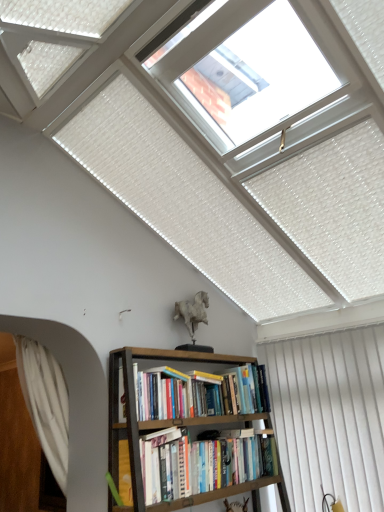
Identify the location of white vertical blinds at right, the first curtain from the right. The width and height of the screenshot is (384, 512). (329, 416).

In order to click on brown wooden bookcase at center in this screenshot , I will do `click(185, 433)`.

Image resolution: width=384 pixels, height=512 pixels. Describe the element at coordinates (165, 465) in the screenshot. I see `hardcover book at lower center` at that location.

You are a GUI agent. You are given a task and a screenshot of the screen. Output one action in this format:
    pyautogui.click(x=<x>, y=<y>)
    Task: Click on the white sheer curtain at left, marked as the 1th curtain in a left-to-right arrangement
    
    Given the screenshot: What is the action you would take?
    pyautogui.click(x=45, y=403)

At what (x,y) coordinates should I click in order to perform the action: click on hardcover books at center. Please return your answer as a coordinate pair (x, y). This screenshot has width=384, height=512. Looking at the image, I should click on (203, 465).

Is hardcover books at center far away from white sheer curtain at left, positioned as the second curtain in right-to-left order?

They are positioned close to each other.

Who is smaller, hardcover books at center or white sheer curtain at left, positioned as the second curtain in right-to-left order?

With smaller size is hardcover books at center.

From the image's perspective, does hardcover books at center appear higher than white sheer curtain at left, marked as the 1th curtain in a left-to-right arrangement?

No, from the image's perspective, hardcover books at center is not above white sheer curtain at left, marked as the 1th curtain in a left-to-right arrangement.

In the scene shown: Is hardcover books at center positioned before white sheer curtain at left, marked as the 1th curtain in a left-to-right arrangement?

No, the depth of hardcover books at center is greater than that of white sheer curtain at left, marked as the 1th curtain in a left-to-right arrangement.

Is hardcover book at lower center wider or thinner than white vertical blinds at right, placed as the second curtain when sorted from left to right?

hardcover book at lower center is wider than white vertical blinds at right, placed as the second curtain when sorted from left to right.

Which object is closer to the camera taking this photo, hardcover book at lower center or white vertical blinds at right, the first curtain from the right?

hardcover book at lower center is more forward.

Is hardcover book at lower center bigger than white vertical blinds at right, the first curtain from the right?

No, hardcover book at lower center is not bigger than white vertical blinds at right, the first curtain from the right.

Considering the sizes of objects hardcover book at lower center and white vertical blinds at right, placed as the second curtain when sorted from left to right, in the image provided, who is taller, hardcover book at lower center or white vertical blinds at right, placed as the second curtain when sorted from left to right,?

Standing taller between the two is white vertical blinds at right, placed as the second curtain when sorted from left to right.

From the picture: How different are the orientations of transparent glass skylight at upper center and white sheer curtain at left, marked as the 1th curtain in a left-to-right arrangement, in degrees?

92.6 degrees.

Would you say white sheer curtain at left, positioned as the second curtain in right-to-left order, is part of transparent glass skylight at upper center's contents?

No, white sheer curtain at left, positioned as the second curtain in right-to-left order, is not inside transparent glass skylight at upper center.

Is the position of transparent glass skylight at upper center less distant than that of white sheer curtain at left, positioned as the second curtain in right-to-left order?

Yes, transparent glass skylight at upper center is closer to the viewer.

Is transparent glass skylight at upper center at the right side of white sheer curtain at left, marked as the 1th curtain in a left-to-right arrangement?

Indeed, transparent glass skylight at upper center is positioned on the right side of white sheer curtain at left, marked as the 1th curtain in a left-to-right arrangement.

From a real-world perspective, is white vertical blinds at right, the first curtain from the right, positioned above or below brown wooden bookcase at center?

In terms of real-world spatial position, white vertical blinds at right, the first curtain from the right, is above brown wooden bookcase at center.

Can you tell me how much white vertical blinds at right, placed as the second curtain when sorted from left to right, and brown wooden bookcase at center differ in facing direction?

There is a 89.7-degree angle between the facing directions of white vertical blinds at right, placed as the second curtain when sorted from left to right, and brown wooden bookcase at center.

Can brown wooden bookcase at center be found inside white vertical blinds at right, placed as the second curtain when sorted from left to right?

That's incorrect, brown wooden bookcase at center is not inside white vertical blinds at right, placed as the second curtain when sorted from left to right.

Which is in front, white vertical blinds at right, the first curtain from the right, or brown wooden bookcase at center?

brown wooden bookcase at center is in front.

Considering the sizes of white sheer curtain at left, positioned as the second curtain in right-to-left order, and brown wooden bookcase at center in the image, is white sheer curtain at left, positioned as the second curtain in right-to-left order, taller or shorter than brown wooden bookcase at center?

Considering their sizes, white sheer curtain at left, positioned as the second curtain in right-to-left order, has more height than brown wooden bookcase at center.

How different are the orientations of white sheer curtain at left, positioned as the second curtain in right-to-left order, and brown wooden bookcase at center in degrees?

177 degrees separate the facing orientations of white sheer curtain at left, positioned as the second curtain in right-to-left order, and brown wooden bookcase at center.

Does white sheer curtain at left, marked as the 1th curtain in a left-to-right arrangement, have a lesser width compared to brown wooden bookcase at center?

Yes, white sheer curtain at left, marked as the 1th curtain in a left-to-right arrangement, is thinner than brown wooden bookcase at center.

Could you tell me if white sheer curtain at left, positioned as the second curtain in right-to-left order, is turned towards brown wooden bookcase at center?

No.

How different are the orientations of hardcover books at center and transparent glass skylight at upper center in degrees?

The angular difference between hardcover books at center and transparent glass skylight at upper center is 89.7 degrees.

Is there a large distance between hardcover books at center and transparent glass skylight at upper center?

Yes, hardcover books at center is far from transparent glass skylight at upper center.

Is point (273, 475) less distant than point (209, 113)?

No, (273, 475) is behind (209, 113).

From the image's perspective, is hardcover books at center positioned above or below transparent glass skylight at upper center?

Clearly, from the image's perspective, hardcover books at center is below transparent glass skylight at upper center.

Identify the location of curtain that is above the hardcover book at lower center (from the image's perspective). (45, 403).

Which of these two, hardcover book at lower center or white sheer curtain at left, marked as the 1th curtain in a left-to-right arrangement, stands shorter?

hardcover book at lower center is shorter.

Considering the relative positions of hardcover book at lower center and white sheer curtain at left, positioned as the second curtain in right-to-left order, in the image provided, is hardcover book at lower center to the left of white sheer curtain at left, positioned as the second curtain in right-to-left order, from the viewer's perspective?

No, hardcover book at lower center is not to the left of white sheer curtain at left, positioned as the second curtain in right-to-left order.

What are the coordinates of `curtain on the left of hardcover books at center` in the screenshot? It's located at (45, 403).

The height and width of the screenshot is (512, 384). In order to click on paperback book in front of the white vertical blinds at right, placed as the second curtain when sorted from left to right in this screenshot , I will do `click(165, 465)`.

When comparing their distances from hardcover book at lower center, does hardcover books at center or brown wooden bookcase at center seem further?

Based on the image, brown wooden bookcase at center appears to be further to hardcover book at lower center.

Looking at the image, which one is located further to white vertical blinds at right, the first curtain from the right, hardcover book at lower center or hardcover books at center?

hardcover book at lower center lies further to white vertical blinds at right, the first curtain from the right, than the other object.

When comparing their distances from white vertical blinds at right, the first curtain from the right, does white sheer curtain at left, positioned as the second curtain in right-to-left order, or hardcover book at lower center seem further?

white sheer curtain at left, positioned as the second curtain in right-to-left order.

From the image, which object appears to be nearer to hardcover book at lower center, white sheer curtain at left, marked as the 1th curtain in a left-to-right arrangement, or brown wooden bookcase at center?

brown wooden bookcase at center.

Based on their spatial positions, is brown wooden bookcase at center or hardcover books at center further from white vertical blinds at right, placed as the second curtain when sorted from left to right?

brown wooden bookcase at center lies further to white vertical blinds at right, placed as the second curtain when sorted from left to right, than the other object.

Estimate the real-world distances between objects in this image. Which object is further from hardcover books at center, white sheer curtain at left, positioned as the second curtain in right-to-left order, or transparent glass skylight at upper center?

transparent glass skylight at upper center lies further to hardcover books at center than the other object.

From the image, which object appears to be farther from brown wooden bookcase at center, hardcover book at lower center or hardcover books at center?

hardcover book at lower center is positioned further to the anchor brown wooden bookcase at center.

From the image, which object appears to be farther from white vertical blinds at right, placed as the second curtain when sorted from left to right, brown wooden bookcase at center or hardcover book at lower center?

Based on the image, hardcover book at lower center appears to be further to white vertical blinds at right, placed as the second curtain when sorted from left to right.

This screenshot has height=512, width=384. Identify the location of curtain that lies between transparent glass skylight at upper center and hardcover book at lower center from top to bottom. (45, 403).

Find the location of a particular element. book located between hardcover book at lower center and white vertical blinds at right, the first curtain from the right, in the left-right direction is located at coordinates (203, 465).

I want to click on bookcase between transparent glass skylight at upper center and hardcover book at lower center in the vertical direction, so click(185, 433).

At what (x,y) coordinates should I click in order to perform the action: click on paperback book located between white sheer curtain at left, marked as the 1th curtain in a left-to-right arrangement, and brown wooden bookcase at center in the left-right direction. Please return your answer as a coordinate pair (x, y). The image size is (384, 512). Looking at the image, I should click on (165, 465).